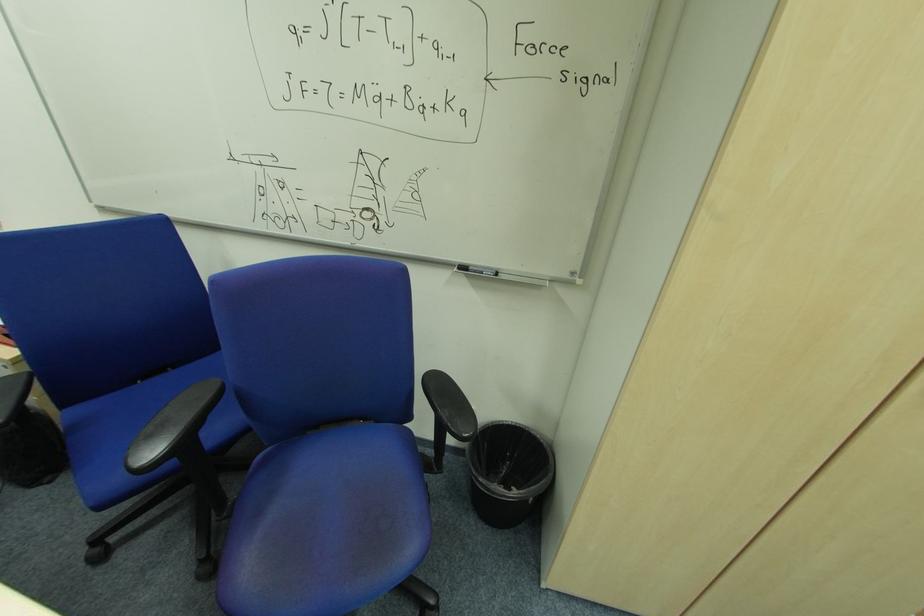
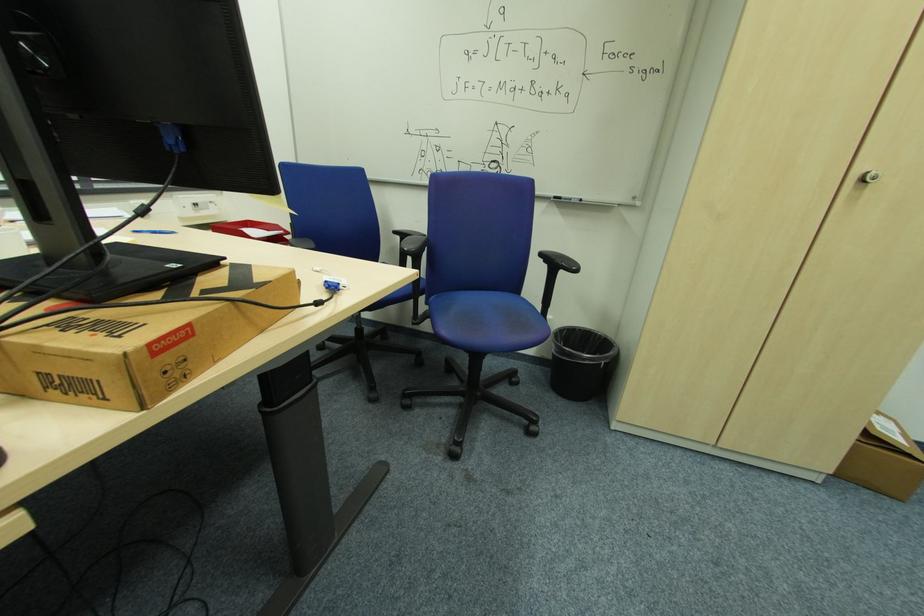
Question: The images are taken continuously from a first-person perspective. In which direction is your viewpoint rotating?

Choices:
 (A) Left
 (B) Right
 (C) Up
 (D) Down

Answer: (C)